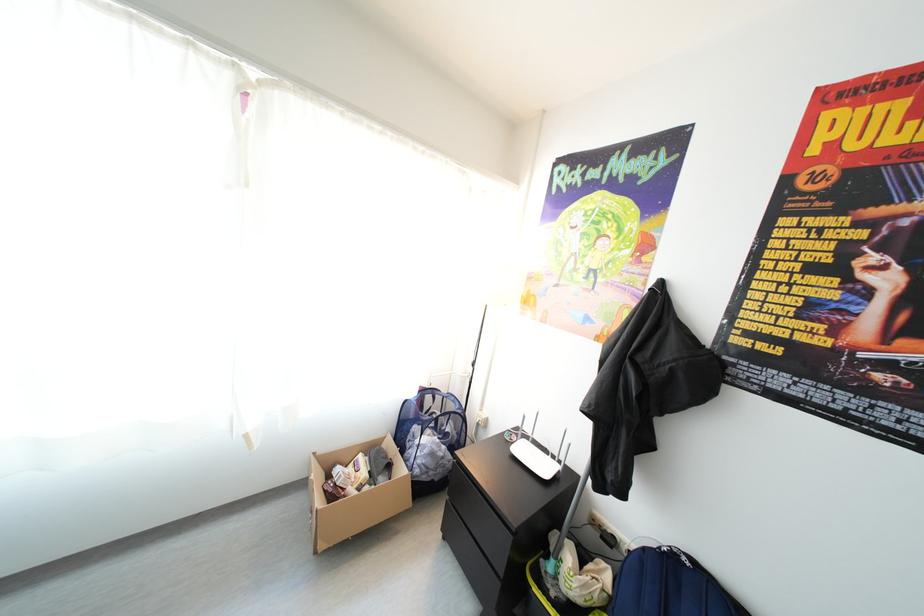
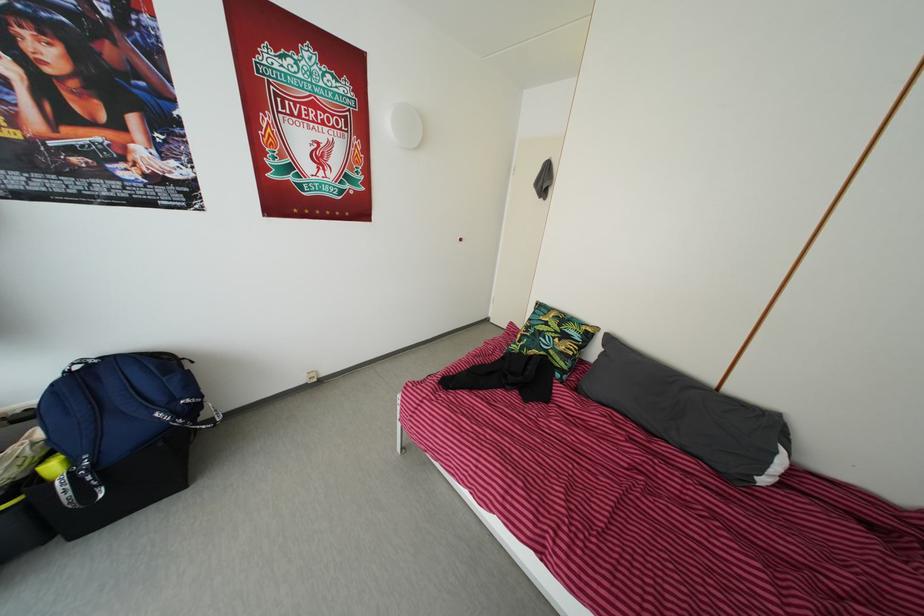
Based on the photo, first-person continuous shooting, in which direction is the camera rotating?

The camera's rotation is toward right-down.